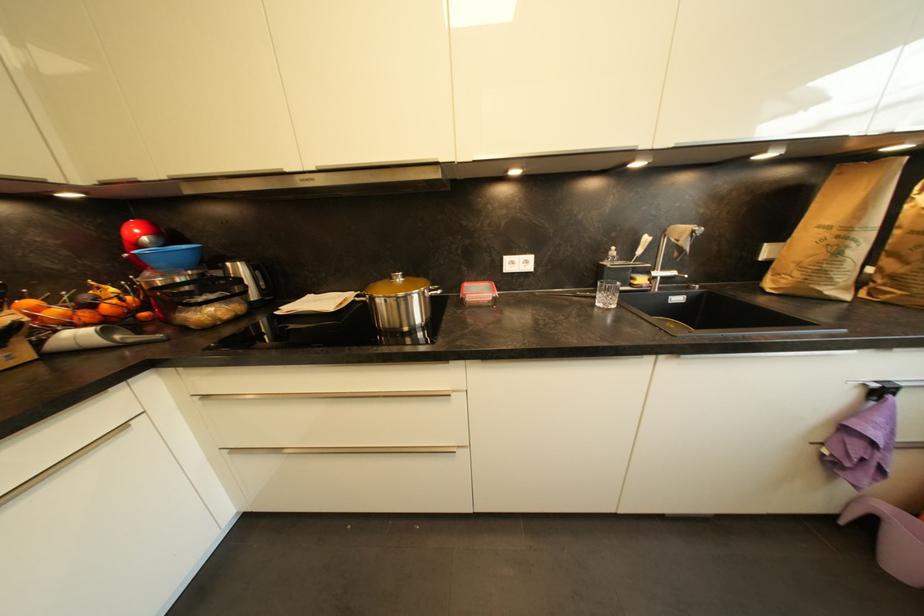
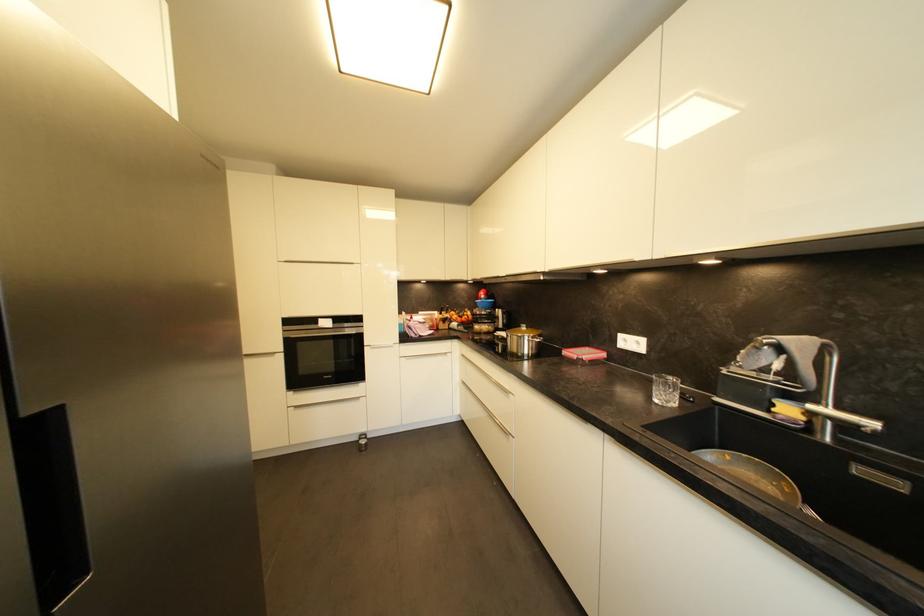
Locate, in the second image, the point that corresponds to pixel 684 302 in the first image.

(904, 487)